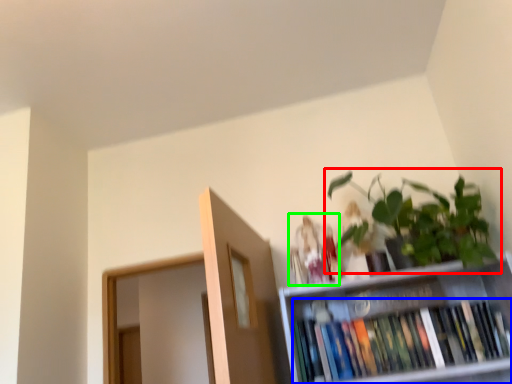
Question: Considering the real-world distances, which object is closest to houseplant (highlighted by a red box)? book (highlighted by a blue box) or toy (highlighted by a green box).

Choices:
 (A) book
 (B) toy

Answer: (B)